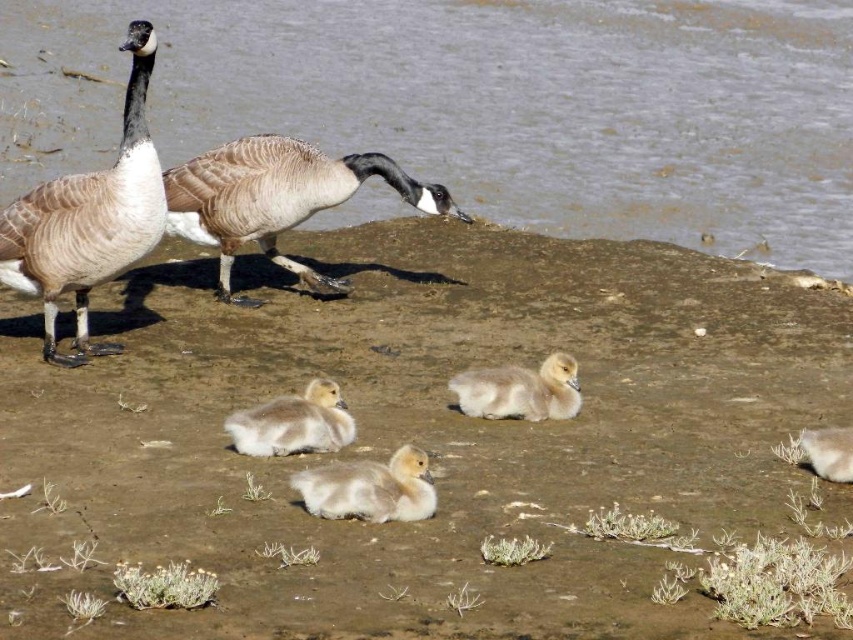
This screenshot has height=640, width=853. What are the coordinates of `clear water at upper center` in the screenshot? It's located at (483, 104).

Consider the image. Between clear water at upper center and white fluffy duckling at lower right, which one is positioned lower?

white fluffy duckling at lower right

Identify the location of clear water at upper center. (483, 104).

Between brown sandy ground at center and brown feathered goose at center, which one is positioned higher?

brown feathered goose at center is higher up.

Can you confirm if brown sandy ground at center is positioned to the right of brown feathered goose at center?

Correct, you'll find brown sandy ground at center to the right of brown feathered goose at center.

Describe the element at coordinates (421, 440) in the screenshot. I see `brown sandy ground at center` at that location.

At what (x,y) coordinates should I click in order to perform the action: click on brown sandy ground at center. Please return your answer as a coordinate pair (x, y). Image resolution: width=853 pixels, height=640 pixels. Looking at the image, I should click on (421, 440).

This screenshot has width=853, height=640. Describe the element at coordinates (421, 440) in the screenshot. I see `brown sandy ground at center` at that location.

Is point (779, 536) closer to camera compared to point (339, 500)?

No.

Image resolution: width=853 pixels, height=640 pixels. I want to click on brown sandy ground at center, so click(421, 440).